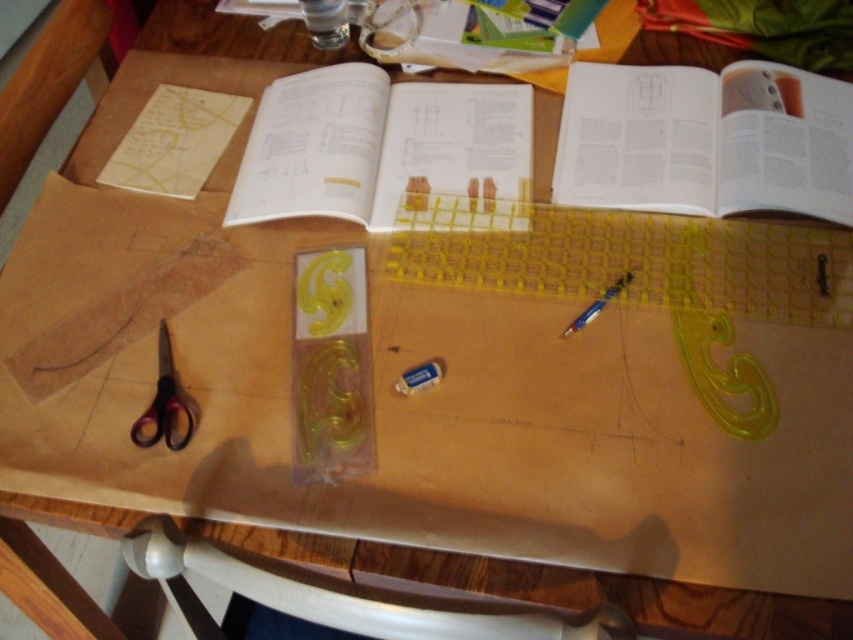
Question: Which point appears closest to the camera in this image?

Choices:
 (A) (834, 160)
 (B) (584, 320)

Answer: (B)

Question: Estimate the real-world distances between objects in this image. Which object is farther from the white paper at center?

Choices:
 (A) white matte eraser at center
 (B) black plastic scissors at lower left
 (C) blue metallic pen at center
 (D) white paper book at upper right

Answer: (B)

Question: Can you confirm if white paper book at upper right is positioned above blue metallic pen at center?

Choices:
 (A) yes
 (B) no

Answer: (A)

Question: Among these objects, which one is farthest from the camera?

Choices:
 (A) white paper book at upper right
 (B) black plastic scissors at lower left
 (C) white paper at center
 (D) white matte eraser at center

Answer: (C)

Question: Does white matte eraser at center appear over blue metallic pen at center?

Choices:
 (A) no
 (B) yes

Answer: (A)

Question: Is white paper at center behind blue metallic pen at center?

Choices:
 (A) yes
 (B) no

Answer: (A)